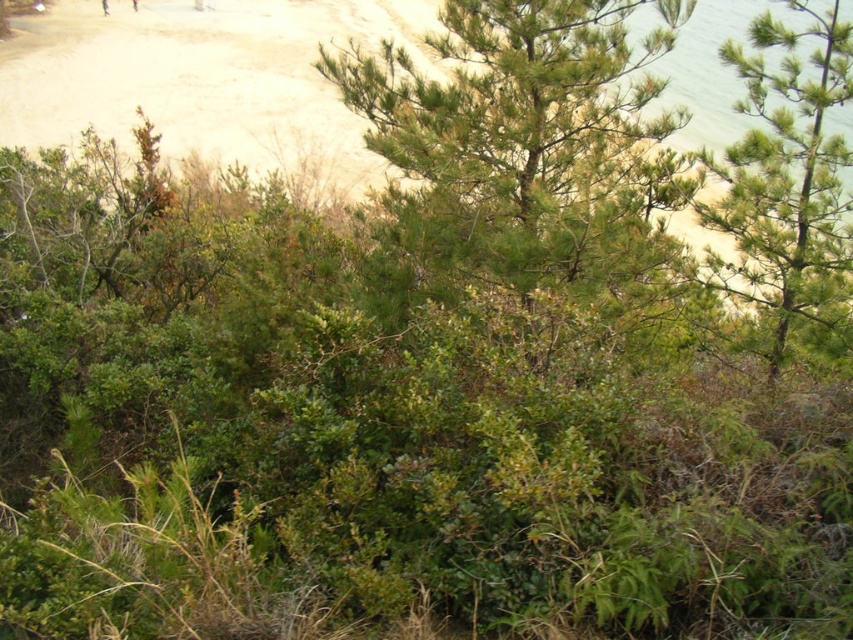
You are standing at the point closest to the foreground in the image. Which point, point (590,192) or point (787,125), is farther away from you?

Point (590,192) is farther away from you because it is behind point (787,125), which is closer to the foreground.

You are standing at the center of the image and see the point marked as point (534, 148). What type of vegetation does this point correspond to?

The point (534, 148) corresponds to green needle like vegetation.